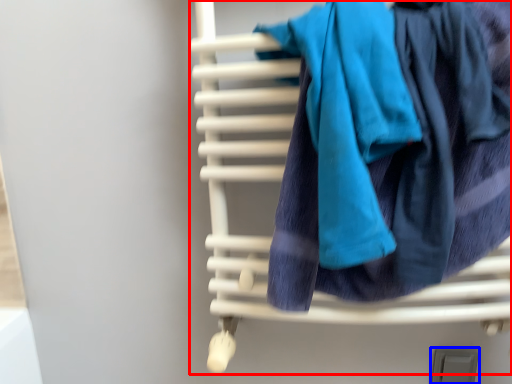
Question: Which of the following is the closest to the observer, furniture (highlighted by a red box) or window (highlighted by a blue box)?

Choices:
 (A) furniture
 (B) window

Answer: (A)